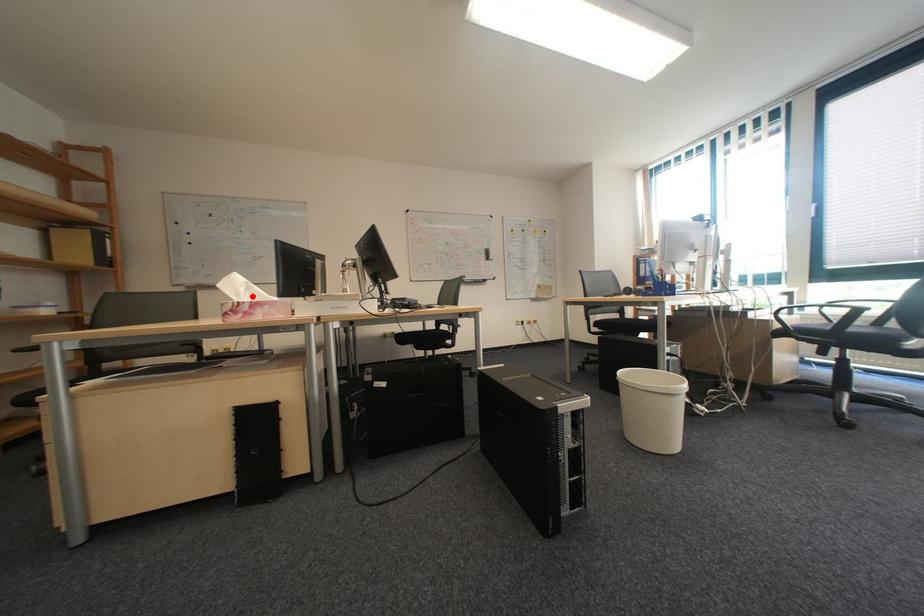
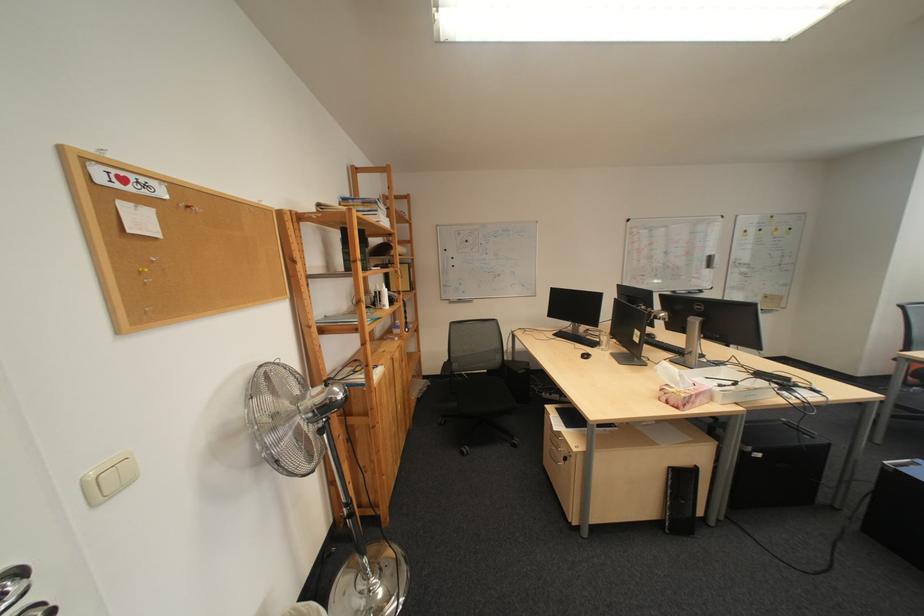
Locate, in the second image, the point that corresponds to the highlighted location in the first image.

(690, 385)